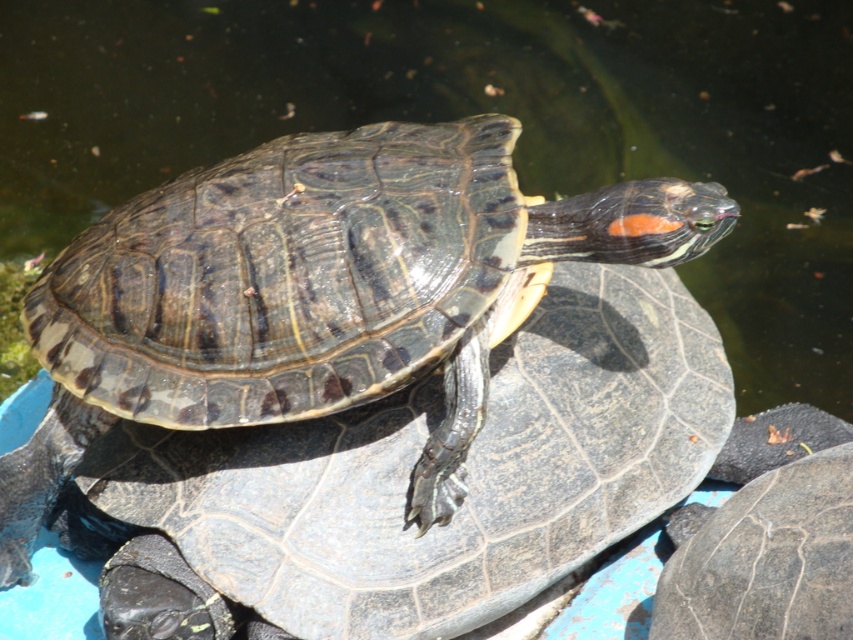
You are a nature photographer observing the turtle in the scene. You need to capture a closeup shot of the shiny dark tortoise at center without the dark gray textured shell at center blocking the view. Is this possible given their sizes?

The shiny dark tortoise at center is larger than the dark gray textured shell at center. Since the shell is part of the tortoise, it cannot be separated, so the dark gray textured shell at center will always be visible when photographing the shiny dark tortoise at center.

Based on the scene description, can you determine the spatial relationship between the shiny dark tortoise at center and the dark gray textured shell at center?

The shiny dark tortoise at center is located above the dark gray textured shell at center.